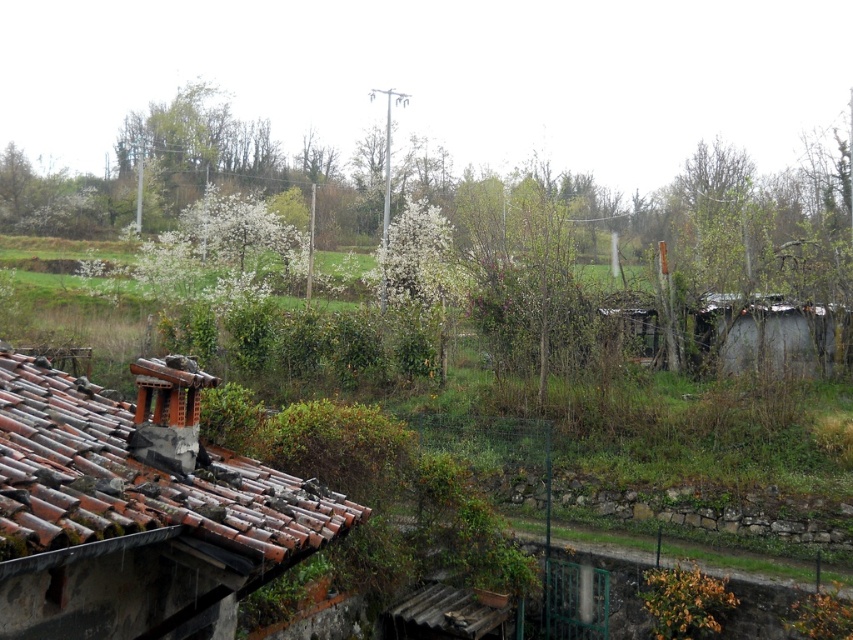
Question: Does rusty clay roof tiles at lower left appear under rusty corrugated metal hut at right?

Choices:
 (A) no
 (B) yes

Answer: (B)

Question: Does rusty clay roof tiles at lower left have a greater width compared to rusty corrugated metal hut at right?

Choices:
 (A) yes
 (B) no

Answer: (A)

Question: Among these objects, which one is nearest to the camera?

Choices:
 (A) rusty corrugated metal hut at right
 (B) rusty clay roof tiles at lower left

Answer: (B)

Question: Does rusty clay roof tiles at lower left have a smaller size compared to rusty corrugated metal hut at right?

Choices:
 (A) yes
 (B) no

Answer: (B)

Question: Which object appears closest to the camera in this image?

Choices:
 (A) rusty corrugated metal hut at right
 (B) rusty clay roof tiles at lower left

Answer: (B)